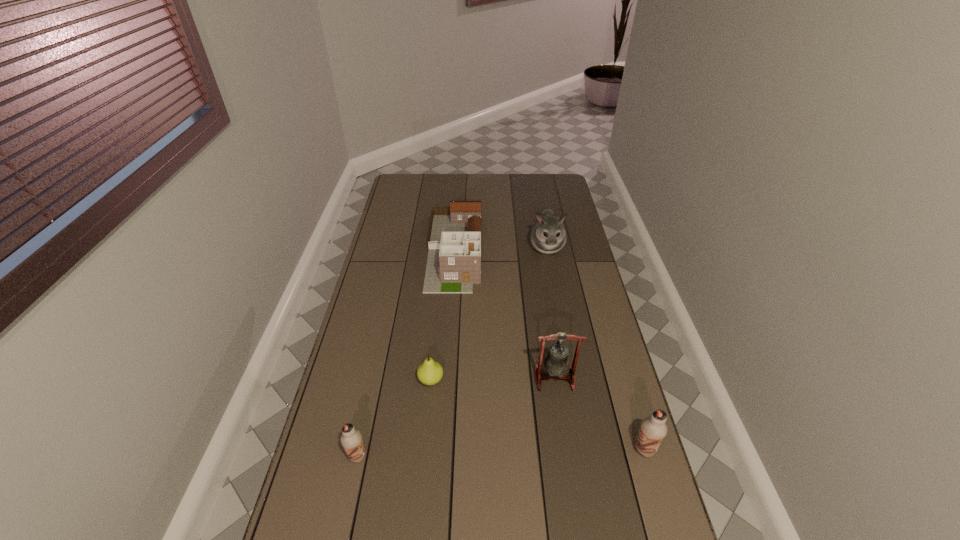
You are a GUI agent. You are given a task and a screenshot of the screen. Output one action in this format:
    pyautogui.click(x=<x>, y=<y>)
    Task: Click on the free space that is in between the second shortest object and the dollhouse
    
    Given the screenshot: What is the action you would take?
    pyautogui.click(x=406, y=353)

This screenshot has width=960, height=540. What are the coordinates of `empty space that is in between the second shortest object and the bell` in the screenshot? It's located at (456, 417).

Where is `empty space that is in between the right chocolate milk and the shorter chocolate milk`? The height and width of the screenshot is (540, 960). empty space that is in between the right chocolate milk and the shorter chocolate milk is located at coordinates (501, 453).

Locate which object ranks fifth in proximity to the bell. Please provide its 2D coordinates. Your answer should be formatted as a tuple, i.e. [(x, y)], where the tuple contains the x and y coordinates of a point satisfying the conditions above.

[(548, 235)]

What are the coordinates of `object that is the fourth closest to the bell` in the screenshot? It's located at (351, 439).

Identify the location of free space that satisfies the following two spatial constraints: 1. at the main entrance of the rightmost object; 2. on the left side of the dollhouse. This screenshot has width=960, height=540. coord(442,449).

Where is `free space that satisfies the following two spatial constraints: 1. at the main entrance of the bell; 2. on the right side of the dollhouse`? free space that satisfies the following two spatial constraints: 1. at the main entrance of the bell; 2. on the right side of the dollhouse is located at coordinates (446, 379).